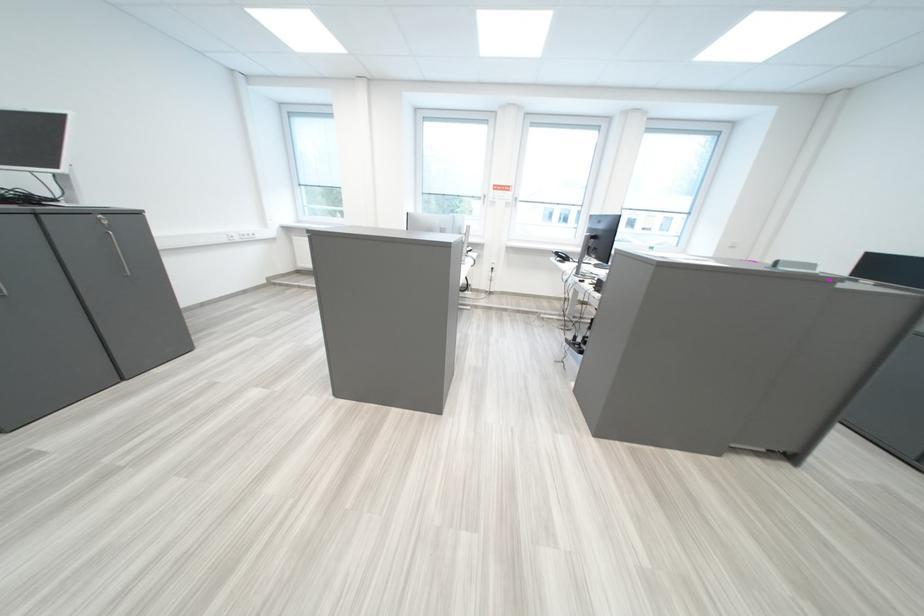
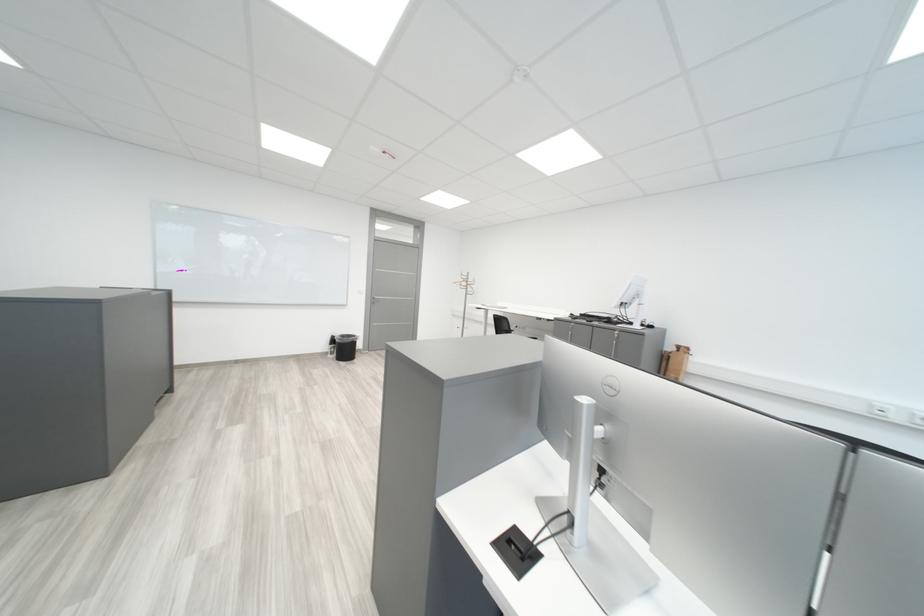
Find the pixel in the second image that matches [250,240] in the first image.

(910, 419)